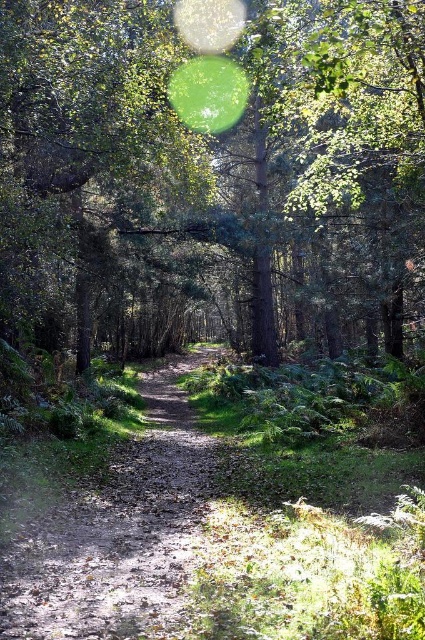
You are a hiker standing at the starting point of the path in the forest. You want to reach the green leafy tree at center. Which direction should you walk to get there?

The green leafy tree at center is located at point coordinates of (209,164), so you should walk towards the center of the image to reach it.

You are a hiker standing on the dirt path at center and looking towards the green leafy tree at center. Which object is taller?

The green leafy tree at center is taller than the dirt path at center.